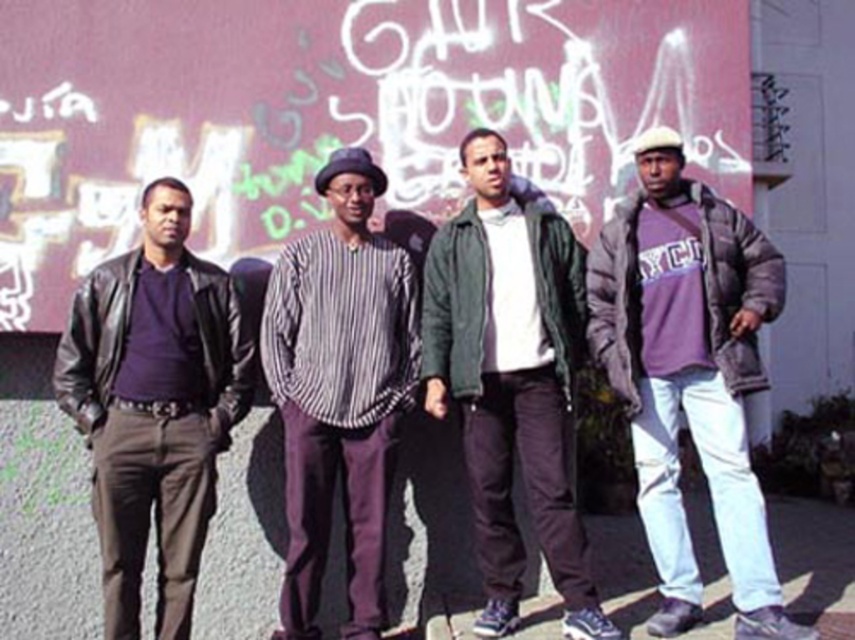
Can you confirm if purple fleece jacket at right is positioned above striped cotton shirt at center?

Yes, purple fleece jacket at right is above striped cotton shirt at center.

Describe the element at coordinates (688, 376) in the screenshot. This screenshot has width=855, height=640. I see `purple fleece jacket at right` at that location.

Describe the element at coordinates (688, 376) in the screenshot. The width and height of the screenshot is (855, 640). I see `purple fleece jacket at right` at that location.

This screenshot has width=855, height=640. What are the coordinates of `purple fleece jacket at right` in the screenshot? It's located at (688, 376).

Is point (653, 390) more distant than point (550, 404)?

No, (653, 390) is in front of (550, 404).

Is purple fleece jacket at right below green matte jacket at center?

Actually, purple fleece jacket at right is above green matte jacket at center.

Who is more forward, (676,324) or (546,509)?

Positioned in front is point (546,509).

What are the coordinates of `purple fleece jacket at right` in the screenshot? It's located at (688, 376).

Based on the photo, is matte black jacket at left to the right of striped cotton shirt at center from the viewer's perspective?

Incorrect, matte black jacket at left is not on the right side of striped cotton shirt at center.

Is point (228, 316) farther from camera compared to point (367, 480)?

Yes, it is behind point (367, 480).

The height and width of the screenshot is (640, 855). Identify the location of matte black jacket at left. (154, 404).